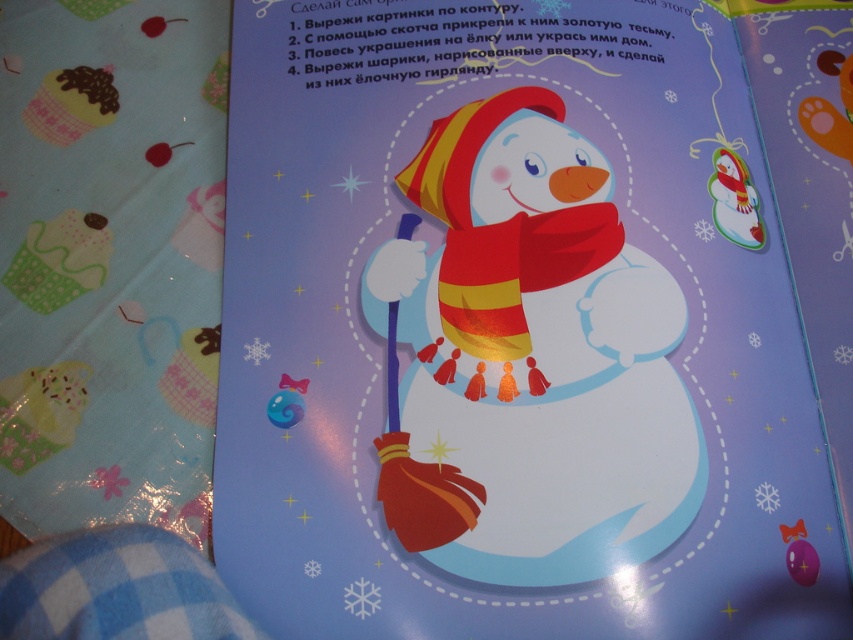
Question: Is matte paper snowman at center above yellow/red striped scarf at center?

Choices:
 (A) yes
 (B) no

Answer: (A)

Question: Estimate the real-world distances between objects in this image. Which object is farther from the yellow/red striped scarf at center?

Choices:
 (A) matte red scarf at center
 (B) matte paper snowman at center

Answer: (B)

Question: Does matte red scarf at center have a greater width compared to yellow/red striped scarf at center?

Choices:
 (A) no
 (B) yes

Answer: (B)

Question: Among these objects, which one is nearest to the camera?

Choices:
 (A) matte red scarf at center
 (B) yellow/red striped scarf at center
 (C) matte paper snowman at center

Answer: (C)

Question: Can you confirm if matte paper snowman at center is thinner than matte red scarf at center?

Choices:
 (A) no
 (B) yes

Answer: (A)

Question: Which of the following is the closest to the observer?

Choices:
 (A) yellow/red striped scarf at center
 (B) matte red scarf at center

Answer: (B)